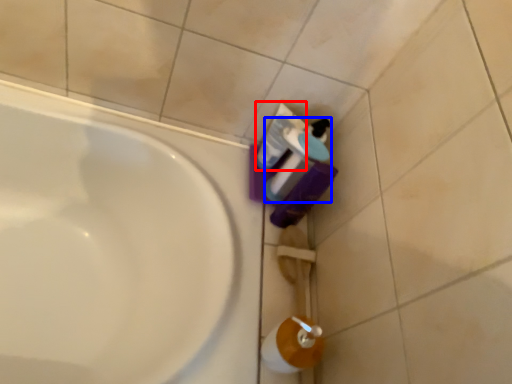
Question: Which object appears closest to the camera in this image, mouthwash (highlighted by a red box) or cleaning product (highlighted by a blue box)?

Choices:
 (A) mouthwash
 (B) cleaning product

Answer: (B)